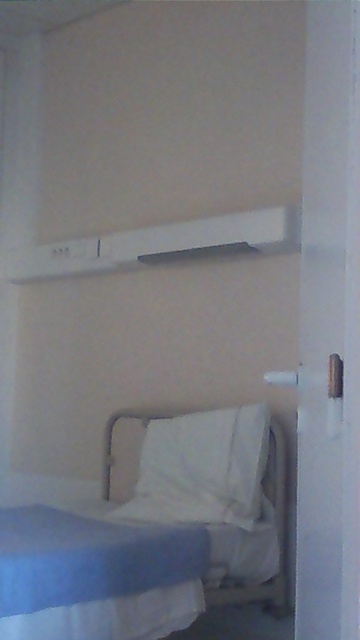
You are standing in the room and want to place a small decorative item on the shelf. The shelf is 1.2 meters wide. If the blue fabric bed at lower left is located at coordinates approximately 0.842 on the x axis and 0.425 on the y axis, will the shelf have enough space to place the item without it hanging over the edge?

The blue fabric bed at lower left is located at coordinates approximately 0.842 on the x axis and 0.425 on the y axis, so the shelf has enough space to place the item without it hanging over the edge.

You are trying to decide whether to place a small decorative item on the blue fabric bed at lower left or the blue soft fabric blanket at lower left. Based on their sizes, which surface can accommodate the item more comfortably?

The blue fabric bed at lower left is larger in size than the blue soft fabric blanket at lower left, so the blue fabric bed at lower left can accommodate the item more comfortably.

You are trying to decide whether to place a new decorative item on the white shelf. The item is 30 cm wide. You see the blue soft fabric blanket at lower left and the white soft pillow at lower center. Which object, if any, could indicate the shelf has enough space for the item?

The blue soft fabric blanket at lower left might be wider than white soft pillow at lower center, so if the shelf can accommodate the blanket, it should also have enough space for the 30 cm decorative item. However, without exact measurements, this is an estimate based on their relative sizes.